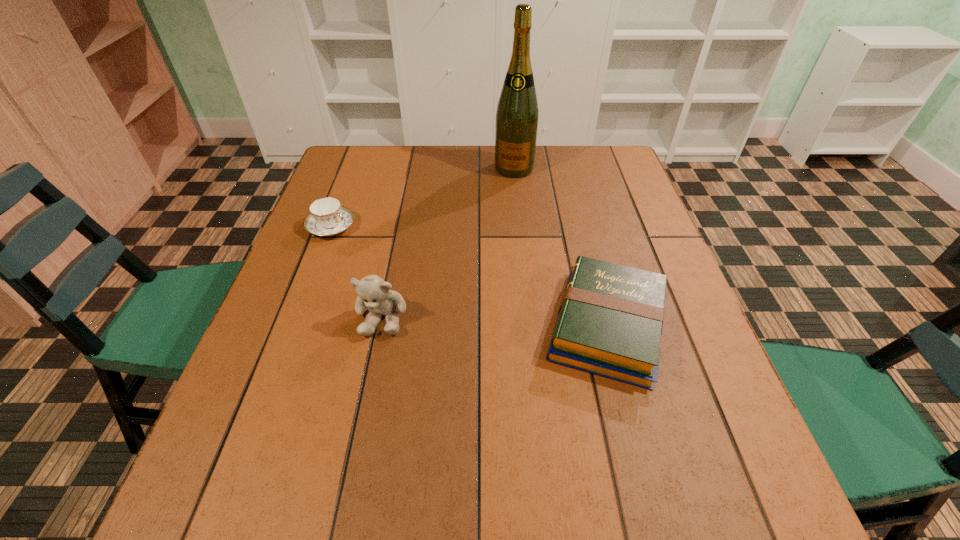
Where is `the second tallest object`? This screenshot has width=960, height=540. the second tallest object is located at coordinates (373, 292).

Where is `teddy bear`? Image resolution: width=960 pixels, height=540 pixels. teddy bear is located at coordinates (373, 292).

Where is `book`? This screenshot has width=960, height=540. book is located at coordinates (609, 323).

Image resolution: width=960 pixels, height=540 pixels. Find the location of `the tallest object`. the tallest object is located at coordinates (517, 115).

You are a GUI agent. You are given a task and a screenshot of the screen. Output one action in this format:
    pyautogui.click(x=<x>, y=<y>)
    Task: Click on the farthest object
    Image resolution: width=960 pixels, height=540 pixels.
    Given the screenshot: What is the action you would take?
    pyautogui.click(x=517, y=115)

I want to click on the leftmost object, so click(327, 217).

You are a GUI agent. You are given a task and a screenshot of the screen. Output one action in this format:
    pyautogui.click(x=<x>, y=<y>)
    Task: Click on the teacup
    
    Given the screenshot: What is the action you would take?
    pyautogui.click(x=327, y=217)

Where is `vacant space located 0.100m on the face of the second object from left to right`? vacant space located 0.100m on the face of the second object from left to right is located at coordinates (369, 384).

I want to click on vacant region located on the left of the book, so click(469, 326).

What are the coordinates of `vacant space located 0.220m on the front-facing side of the wine bottle` in the screenshot? It's located at (502, 224).